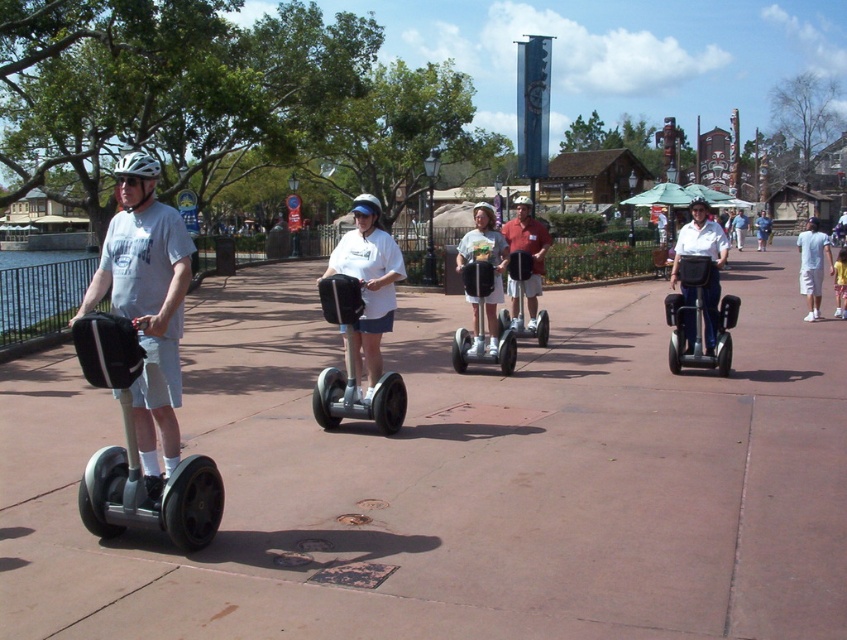
Is black rubber segway at center to the left of white helmet at center from the viewer's perspective?

Correct, you'll find black rubber segway at center to the left of white helmet at center.

Can you confirm if black rubber segway at center is positioned above white helmet at center?

Incorrect, black rubber segway at center is not positioned above white helmet at center.

This screenshot has width=847, height=640. What do you see at coordinates (480, 324) in the screenshot?
I see `black rubber segway at center` at bounding box center [480, 324].

I want to click on black rubber segway at center, so click(x=480, y=324).

Does silver metallic segway at left lie in front of denim shorts at center?

That is True.

Can you confirm if silver metallic segway at left is thinner than denim shorts at center?

Correct, silver metallic segway at left's width is less than denim shorts at center's.

You are a GUI agent. You are given a task and a screenshot of the screen. Output one action in this format:
    pyautogui.click(x=<x>, y=<y>)
    Task: Click on the silver metallic segway at left
    
    Given the screenshot: What is the action you would take?
    pyautogui.click(x=137, y=454)

Is matte white helmet at center in front of black rubber segway at center?

No, it is not.

Is point (477, 352) in front of point (452, 355)?

Yes, it is.

Where is `matte white helmet at center`? matte white helmet at center is located at coordinates (485, 260).